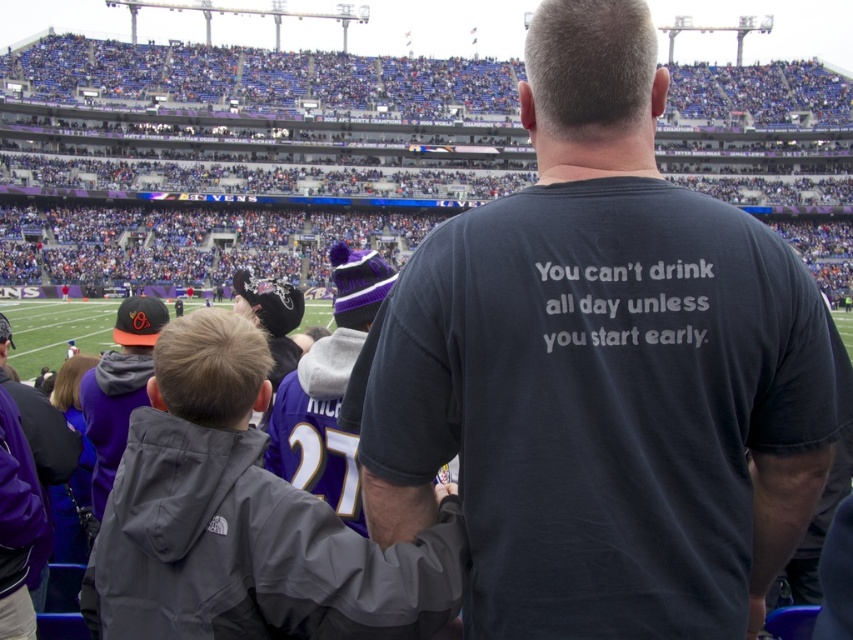
Looking at this image, you are a photographer trying to capture both the purple knit hat at center and the orange matte baseball cap at left in a single frame. Which object should you adjust your camera to focus on first to ensure both are in the shot?

The purple knit hat at center is positioned on the right side of orange matte baseball cap at left. To capture both in a single frame, focus on the orange matte baseball cap at left first since it is on the left, allowing you to adjust the camera to include the purple knit hat at center on its right side.

You are standing at the entrance of the football stadium and want to find the gray fabric jacket at center. According to the spatial coordinates provided, in which direction should you move relative to your current position to locate it?

The gray fabric jacket at center is located at point 0.814 on the x axis and 0.288 on the y axis. Since you are at the entrance, you should move towards the right and slightly forward to reach the coordinates where the gray fabric jacket at center is positioned.

You are standing at the point with coordinates point (129, 316) and want to walk to the exit located at point (560, 67). Is the exit in front of you or behind you?

The exit at point (560, 67) is in front of you because it is positioned in front of point (129, 316) where you are standing.